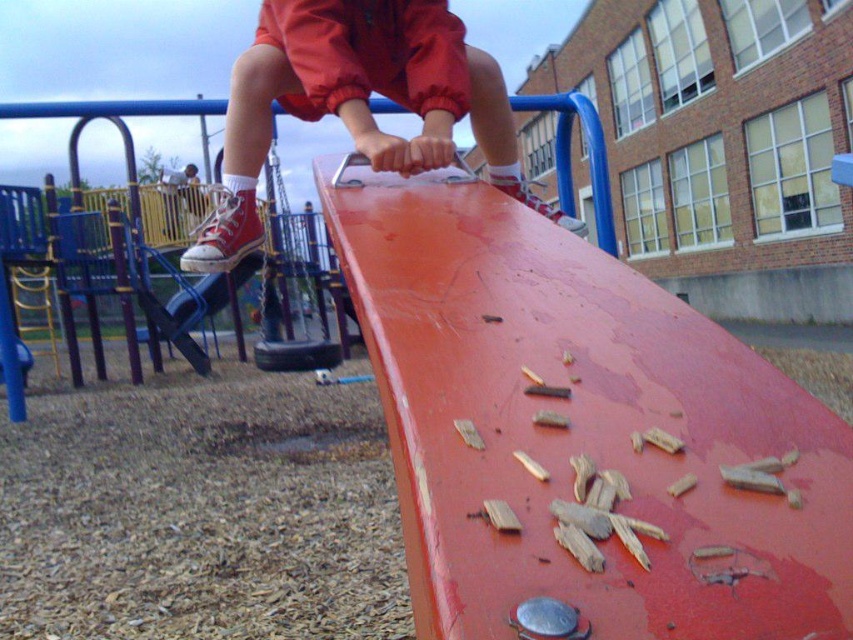
Question: Which of these objects is positioned farthest from the matte red sneakers at upper center?

Choices:
 (A) rubberized black swing at center
 (B) smooth red ramp at center

Answer: (A)

Question: Does matte red sneakers at upper center appear on the right side of rubberized black swing at center?

Choices:
 (A) yes
 (B) no

Answer: (A)

Question: Is smooth red ramp at center in front of matte red sneakers at upper center?

Choices:
 (A) no
 (B) yes

Answer: (B)

Question: Can you confirm if smooth red ramp at center is positioned above matte red sneakers at upper center?

Choices:
 (A) yes
 (B) no

Answer: (B)

Question: Which of these objects is positioned closest to the rubberized black swing at center?

Choices:
 (A) matte red sneakers at upper center
 (B) smooth red ramp at center

Answer: (A)

Question: Which of the following is the farthest from the observer?

Choices:
 (A) matte red sneakers at upper center
 (B) smooth red ramp at center

Answer: (A)